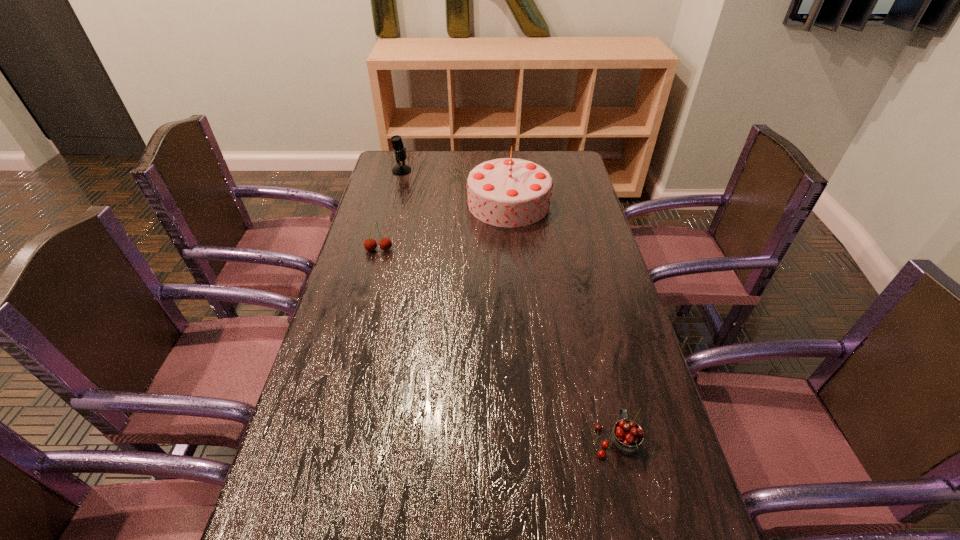
Identify the location of the second closest object relative to the third nearest object. (370, 244).

Locate which object ranks third in proximity to the tallest object. Please provide its 2D coordinates. Your answer should be formatted as a tuple, i.e. [(x, y)], where the tuple contains the x and y coordinates of a point satisfying the conditions above.

[(626, 437)]

Where is `cherry that can be found as the second closest to the farthest object`? cherry that can be found as the second closest to the farthest object is located at coordinates (626, 437).

This screenshot has width=960, height=540. What are the coordinates of `cherry that is the second closest to the farthest object` in the screenshot? It's located at (626, 437).